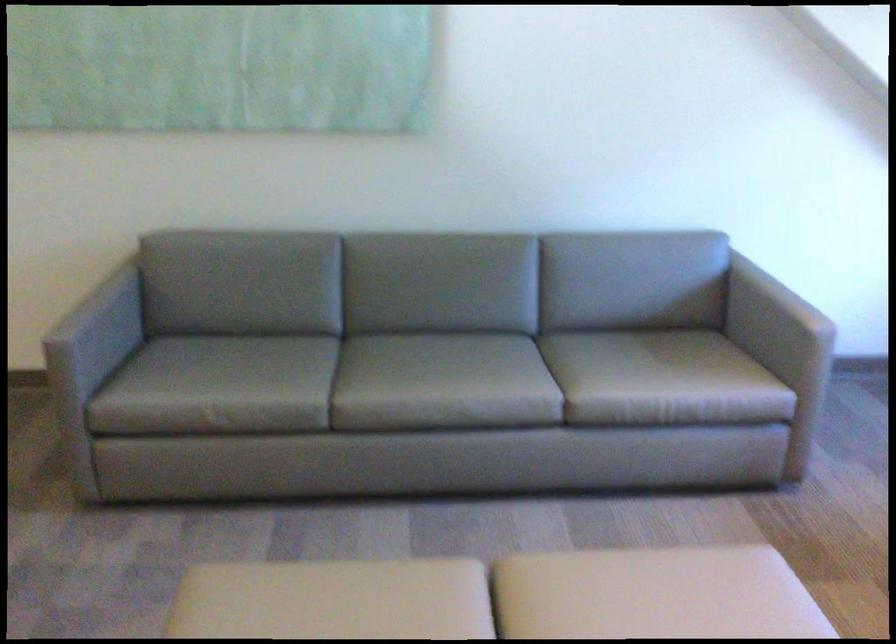
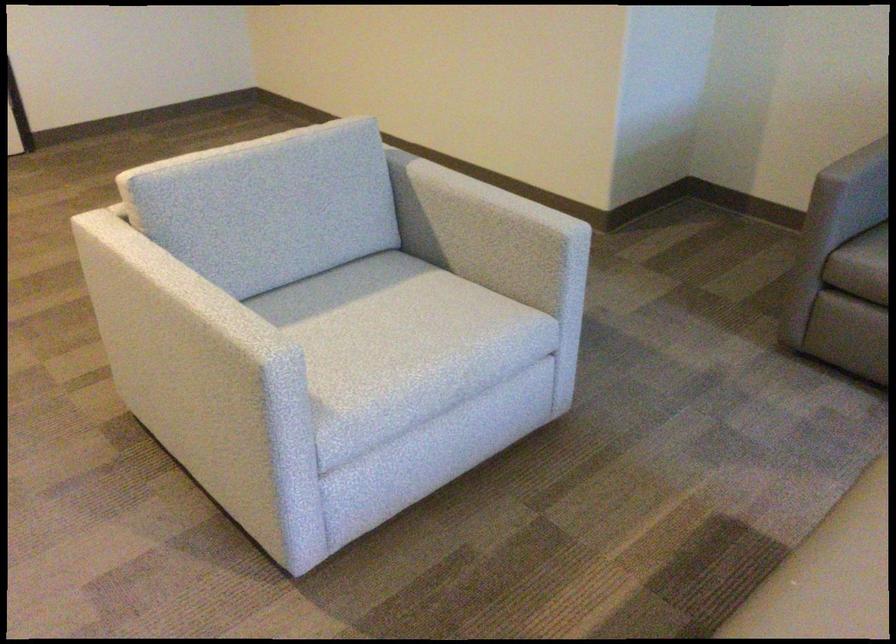
Where in the second image is the point corresponding to [74,323] from the first image?

(858, 164)